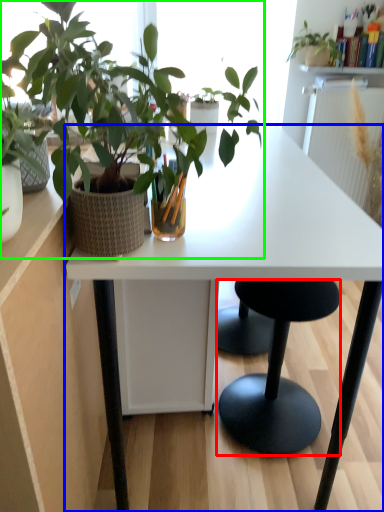
Question: Based on their relative distances, which object is nearer to stool (highlighted by a red box)? Choose from desk (highlighted by a blue box) and houseplant (highlighted by a green box).

Choices:
 (A) desk
 (B) houseplant

Answer: (A)